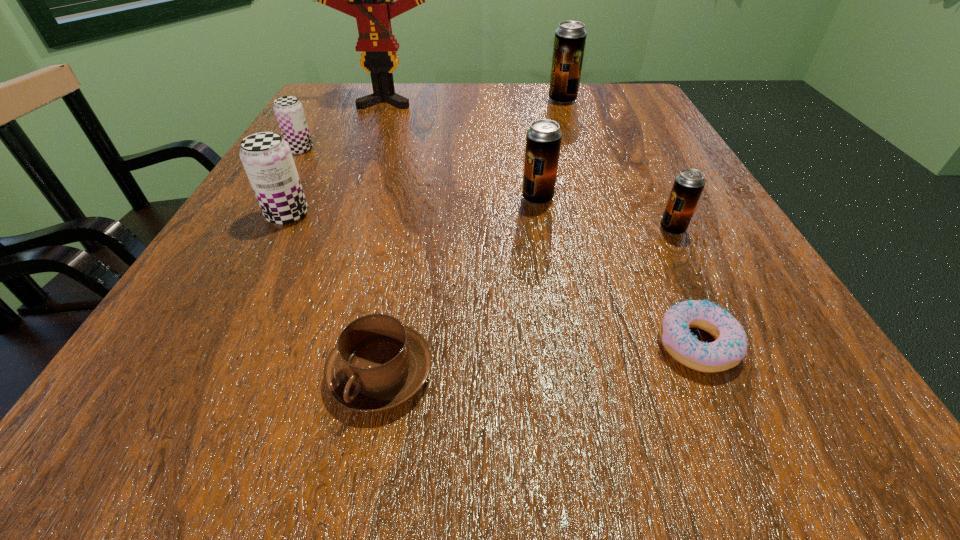
Find the location of `vacant space that's between the rightmost black beer can and the brown cappuccino`. vacant space that's between the rightmost black beer can and the brown cappuccino is located at coordinates (527, 301).

Where is `vacant space that is in between the biggest black beer can and the smaller purple beer can`? This screenshot has width=960, height=540. vacant space that is in between the biggest black beer can and the smaller purple beer can is located at coordinates (431, 125).

This screenshot has width=960, height=540. Find the location of `free spot between the bigger purple beer can and the shortest object`. free spot between the bigger purple beer can and the shortest object is located at coordinates (492, 280).

Select which object is the closest to the bigger purple beer can. Please provide its 2D coordinates. Your answer should be formatted as a tuple, i.e. [(x, y)], where the tuple contains the x and y coordinates of a point satisfying the conditions above.

[(289, 113)]

The width and height of the screenshot is (960, 540). Identify the location of the closest object to the smaller purple beer can. (267, 159).

At what (x,y) coordinates should I click in order to perform the action: click on beer can object that ranks as the fourth closest to the farther purple beer can. Please return your answer as a coordinate pair (x, y). Looking at the image, I should click on (688, 185).

At what (x,y) coordinates should I click in order to perform the action: click on beer can that is the closest one to the third beer can from left to right. Please return your answer as a coordinate pair (x, y). The width and height of the screenshot is (960, 540). Looking at the image, I should click on (688, 185).

Identify which black beer can is the second nearest to the second farthest black beer can. Please provide its 2D coordinates. Your answer should be formatted as a tuple, i.e. [(x, y)], where the tuple contains the x and y coordinates of a point satisfying the conditions above.

[(570, 37)]

Image resolution: width=960 pixels, height=540 pixels. I want to click on black beer can that is the nearest to the nearest black beer can, so [x=543, y=139].

The width and height of the screenshot is (960, 540). Find the location of `vacant space that satisfies the following two spatial constraints: 1. on the front-facing side of the rightmost beer can; 2. on the right side of the tallest object`. vacant space that satisfies the following two spatial constraints: 1. on the front-facing side of the rightmost beer can; 2. on the right side of the tallest object is located at coordinates (338, 229).